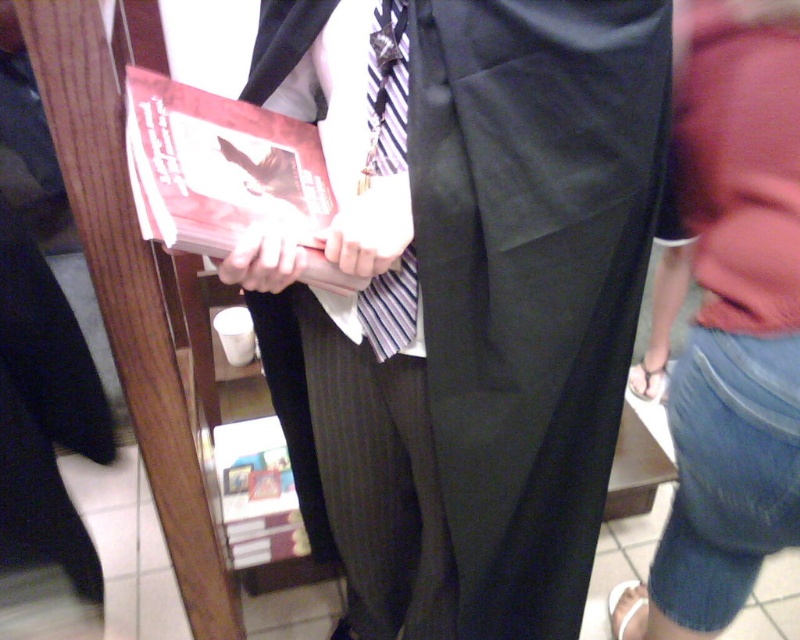
Can you confirm if striped fabric tie at center is smaller than matte black hand at center?

No, striped fabric tie at center is not smaller than matte black hand at center.

Who is positioned more to the left, striped fabric tie at center or matte black hand at center?

From the viewer's perspective, matte black hand at center appears more on the left side.

Find the location of a particular element. striped fabric tie at center is located at coordinates (388, 92).

Who is taller, black satin pants at center or denim shorts at lower right?

Standing taller between the two is denim shorts at lower right.

Based on the photo, is black satin pants at center above denim shorts at lower right?

Correct, black satin pants at center is located above denim shorts at lower right.

Where is `black satin pants at center`? The height and width of the screenshot is (640, 800). black satin pants at center is located at coordinates (480, 304).

Locate an element on the screen. Image resolution: width=800 pixels, height=640 pixels. black satin pants at center is located at coordinates (480, 304).

Does black satin pants at center have a lesser width compared to striped fabric tie at center?

Incorrect, black satin pants at center's width is not less than striped fabric tie at center's.

Which is in front, point (325, 371) or point (408, 248)?

Point (408, 248) is more forward.

You are a GUI agent. You are given a task and a screenshot of the screen. Output one action in this format:
    pyautogui.click(x=<x>, y=<y>)
    Task: Click on the black satin pants at center
    This screenshot has height=640, width=800.
    Given the screenshot: What is the action you would take?
    pyautogui.click(x=480, y=304)